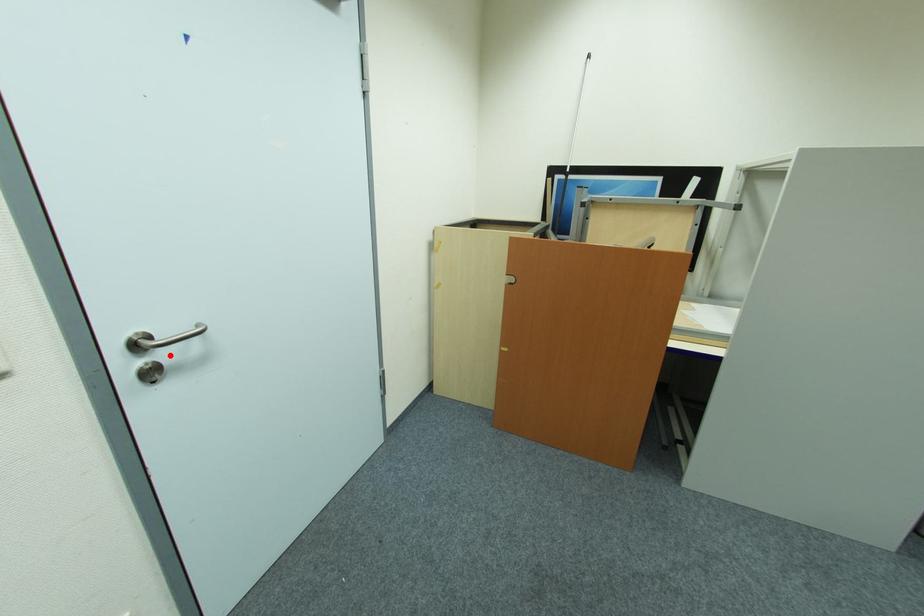
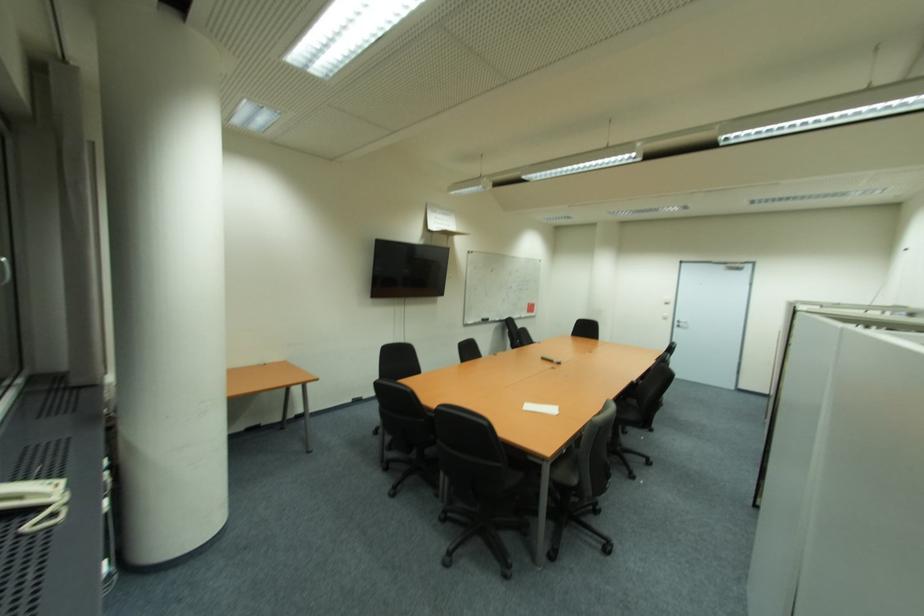
Find the pixel in the second image that matches the highlighted location in the first image.

(686, 325)